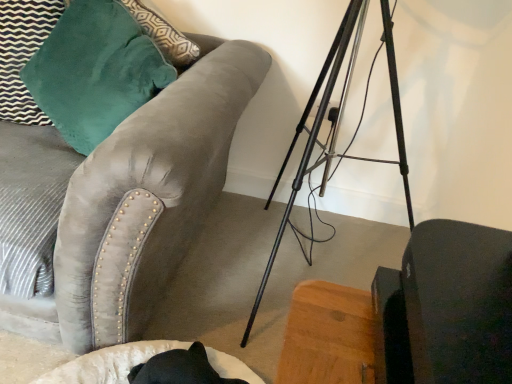
Question: From the image's perspective, is velvet gray couch at upper left located beneath matte black swivel chair at lower right?

Choices:
 (A) yes
 (B) no

Answer: (B)

Question: From the image's perspective, is velvet gray couch at upper left above matte black swivel chair at lower right?

Choices:
 (A) no
 (B) yes

Answer: (B)

Question: From a real-world perspective, is velvet gray couch at upper left physically below matte black swivel chair at lower right?

Choices:
 (A) no
 (B) yes

Answer: (B)

Question: Does velvet gray couch at upper left have a greater height compared to matte black swivel chair at lower right?

Choices:
 (A) yes
 (B) no

Answer: (A)

Question: Is velvet gray couch at upper left positioned far away from matte black swivel chair at lower right?

Choices:
 (A) yes
 (B) no

Answer: (B)

Question: Can you confirm if velvet gray couch at upper left is bigger than matte black swivel chair at lower right?

Choices:
 (A) no
 (B) yes

Answer: (B)

Question: Is velvet gray couch at upper left in front of velvet teal pillow at upper left?

Choices:
 (A) no
 (B) yes

Answer: (B)

Question: Is velvet gray couch at upper left oriented away from velvet teal pillow at upper left?

Choices:
 (A) no
 (B) yes

Answer: (B)

Question: Can you confirm if velvet gray couch at upper left is positioned to the right of velvet teal pillow at upper left?

Choices:
 (A) yes
 (B) no

Answer: (B)

Question: From a real-world perspective, is velvet gray couch at upper left located beneath velvet teal pillow at upper left?

Choices:
 (A) no
 (B) yes

Answer: (B)

Question: Is velvet teal pillow at upper left completely or partially inside velvet gray couch at upper left?

Choices:
 (A) no
 (B) yes

Answer: (B)

Question: From the image's perspective, is velvet gray couch at upper left on velvet teal pillow at upper left?

Choices:
 (A) no
 (B) yes

Answer: (A)

Question: Can you confirm if matte black swivel chair at lower right is smaller than velvet gray couch at upper left?

Choices:
 (A) yes
 (B) no

Answer: (A)